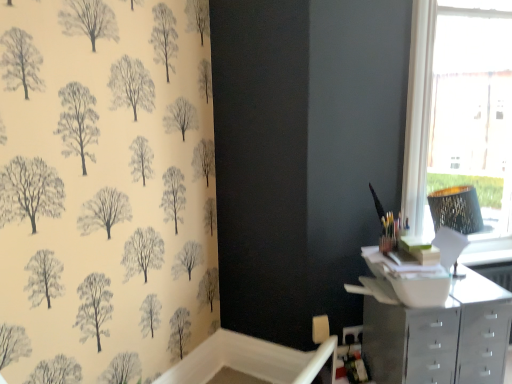
Identify the location of metallic mosaic lampshade at right. (456, 209).

Identify the location of metallic silver chest of drawers at lower right. (440, 336).

The image size is (512, 384). Find the location of `metallic mosaic lampshade at right`. metallic mosaic lampshade at right is located at coordinates (456, 209).

Is white frame at upper right wider than metallic silver chest of drawers at lower right?

No, white frame at upper right is not wider than metallic silver chest of drawers at lower right.

In order to click on the chest of drawers located in front of the white frame at upper right in this screenshot , I will do `click(440, 336)`.

What's the angular difference between white frame at upper right and metallic silver chest of drawers at lower right's facing directions?

white frame at upper right and metallic silver chest of drawers at lower right are facing 1.32 degrees away from each other.

Who is bigger, white frame at upper right or metallic silver chest of drawers at lower right?

With larger size is white frame at upper right.

Is white frame at upper right wider or thinner than white glossy file cabinet at lower right?

Considering their sizes, white frame at upper right looks slimmer than white glossy file cabinet at lower right.

Which is closer, (x=422, y=211) or (x=420, y=358)?

Point (x=420, y=358)

From the image's perspective, which is below, white frame at upper right or white glossy file cabinet at lower right?

white glossy file cabinet at lower right is shown below in the image.

Is there a large distance between white frame at upper right and white glossy file cabinet at lower right?

No, white frame at upper right is not far from white glossy file cabinet at lower right.

Is point (380, 308) closer to camera compared to point (470, 151)?

Yes, point (380, 308) is closer to viewer.

Is white glossy file cabinet at lower right located outside white frame at upper right?

Yes.

From a real-world perspective, is white glossy file cabinet at lower right positioned above or below white frame at upper right?

In terms of real-world spatial position, white glossy file cabinet at lower right is below white frame at upper right.

Would you say white glossy file cabinet at lower right is a long distance from white frame at upper right?

Actually, white glossy file cabinet at lower right and white frame at upper right are a little close together.

Locate an element on the screen. This screenshot has height=384, width=512. file cabinet beneath the metallic mosaic lampshade at right (from a real-world perspective) is located at coordinates (410, 342).

Which is closer to the camera, (x=410, y=318) or (x=479, y=223)?

Point (x=410, y=318) is closer to the camera than point (x=479, y=223).

Considering the sizes of objects white glossy file cabinet at lower right and metallic mosaic lampshade at right in the image provided, who is wider, white glossy file cabinet at lower right or metallic mosaic lampshade at right?

white glossy file cabinet at lower right.

Considering the relative positions of white frame at upper right and metallic mosaic lampshade at right in the image provided, is white frame at upper right to the left of metallic mosaic lampshade at right from the viewer's perspective?

No, white frame at upper right is not to the left of metallic mosaic lampshade at right.

In the scene shown: From the image's perspective, who appears lower, white frame at upper right or metallic mosaic lampshade at right?

metallic mosaic lampshade at right is shown below in the image.

Is white frame at upper right touching metallic mosaic lampshade at right?

white frame at upper right is not next to metallic mosaic lampshade at right, and they're not touching.

Can you confirm if white frame at upper right is taller than metallic mosaic lampshade at right?

Yes, white frame at upper right is taller than metallic mosaic lampshade at right.

Can you see metallic mosaic lampshade at right touching white glossy file cabinet at lower right?

No, metallic mosaic lampshade at right is not making contact with white glossy file cabinet at lower right.

From the image's perspective, does metallic mosaic lampshade at right appear lower than white glossy file cabinet at lower right?

No, from the image's perspective, metallic mosaic lampshade at right is not below white glossy file cabinet at lower right.

Which object is wider, metallic mosaic lampshade at right or white glossy file cabinet at lower right?

white glossy file cabinet at lower right.

From the image's perspective, is metallic mosaic lampshade at right located above or below white frame at upper right?

metallic mosaic lampshade at right is situated lower than white frame at upper right in the image.

In the scene shown: Which of these two, metallic mosaic lampshade at right or white frame at upper right, is wider?

Wider between the two is white frame at upper right.

Is metallic mosaic lampshade at right inside or outside of white frame at upper right?

metallic mosaic lampshade at right is located beyond the bounds of white frame at upper right.

Which object is closer to the camera taking this photo, metallic mosaic lampshade at right or white frame at upper right?

metallic mosaic lampshade at right.

Find the location of `window above the metallic silver chest of drawers at lower right (from a real-world perspective)`. window above the metallic silver chest of drawers at lower right (from a real-world perspective) is located at coordinates (461, 117).

Where is `file cabinet on the left of white frame at upper right`? This screenshot has width=512, height=384. file cabinet on the left of white frame at upper right is located at coordinates (410, 342).

Looking at the image, which one is located further to white glossy file cabinet at lower right, metallic mosaic lampshade at right or metallic silver chest of drawers at lower right?

metallic mosaic lampshade at right is positioned further to the anchor white glossy file cabinet at lower right.

When comparing their distances from metallic mosaic lampshade at right, does white frame at upper right or white glossy file cabinet at lower right seem further?

white glossy file cabinet at lower right is further to metallic mosaic lampshade at right.

Looking at this image, considering their positions, is metallic silver chest of drawers at lower right positioned further to metallic mosaic lampshade at right than white glossy file cabinet at lower right?

white glossy file cabinet at lower right is positioned further to the anchor metallic mosaic lampshade at right.

When comparing their distances from metallic silver chest of drawers at lower right, does metallic mosaic lampshade at right or white frame at upper right seem further?

white frame at upper right lies further to metallic silver chest of drawers at lower right than the other object.

Consider the image. From the image, which object appears to be nearer to metallic mosaic lampshade at right, white frame at upper right or metallic silver chest of drawers at lower right?

Among the two, white frame at upper right is located nearer to metallic mosaic lampshade at right.

Based on the photo, which object lies nearer to the anchor point metallic silver chest of drawers at lower right, white frame at upper right or metallic mosaic lampshade at right?

The object closer to metallic silver chest of drawers at lower right is metallic mosaic lampshade at right.

When comparing their distances from white glossy file cabinet at lower right, does white frame at upper right or metallic mosaic lampshade at right seem further?

Among the two, white frame at upper right is located further to white glossy file cabinet at lower right.

Estimate the real-world distances between objects in this image. Which object is closer to metallic mosaic lampshade at right, white glossy file cabinet at lower right or white frame at upper right?

Based on the image, white frame at upper right appears to be nearer to metallic mosaic lampshade at right.

In order to click on the chest of drawers that lies between metallic mosaic lampshade at right and white glossy file cabinet at lower right from top to bottom in this screenshot , I will do `click(440, 336)`.

Find the location of a particular element. chest of drawers between white frame at upper right and white glossy file cabinet at lower right in the up-down direction is located at coordinates (440, 336).

This screenshot has width=512, height=384. I want to click on lamp between white frame at upper right and metallic silver chest of drawers at lower right in the vertical direction, so click(456, 209).

The image size is (512, 384). What are the coordinates of `lamp between white frame at upper right and white glossy file cabinet at lower right in the vertical direction` in the screenshot? It's located at (456, 209).